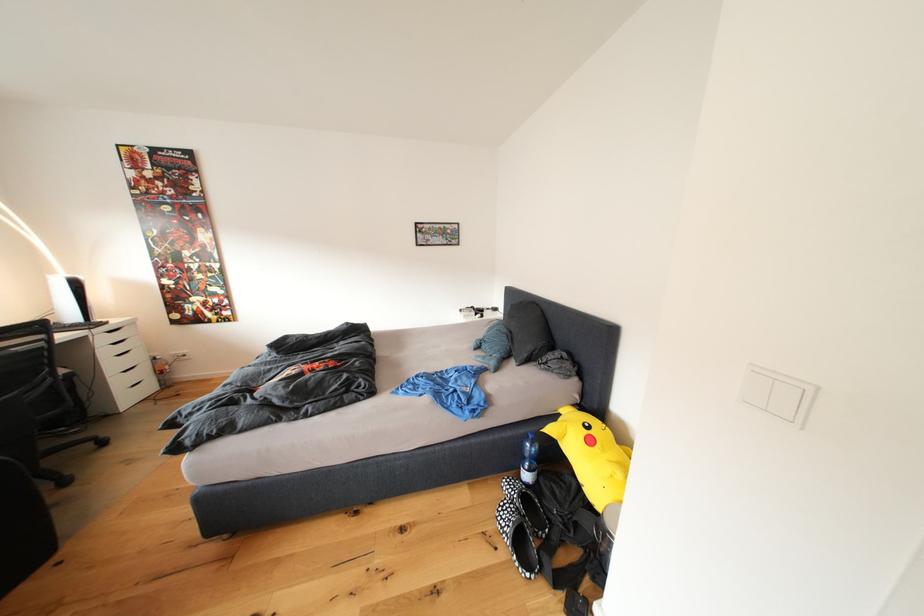
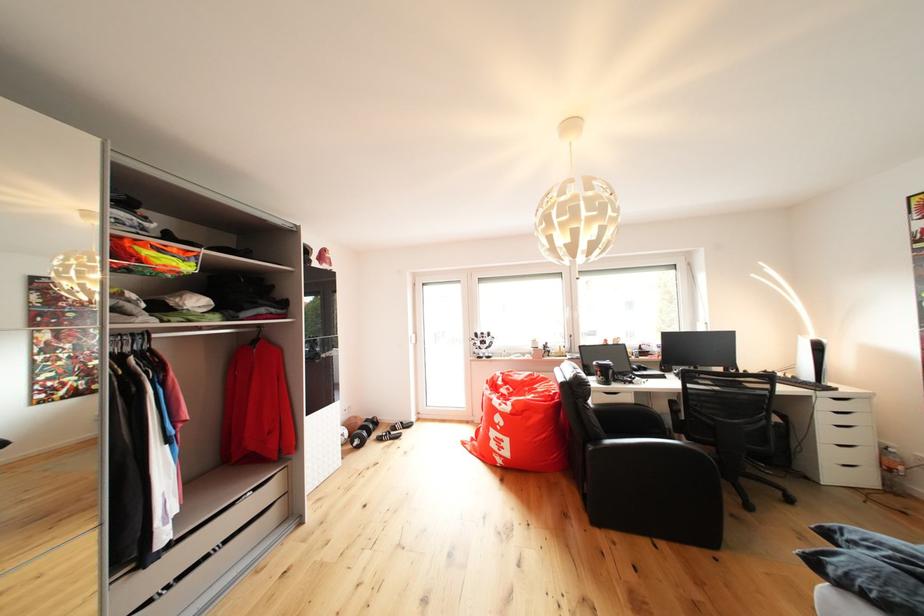
Find the pixel in the second image that matches the point at 126,342 in the first image.

(850, 411)